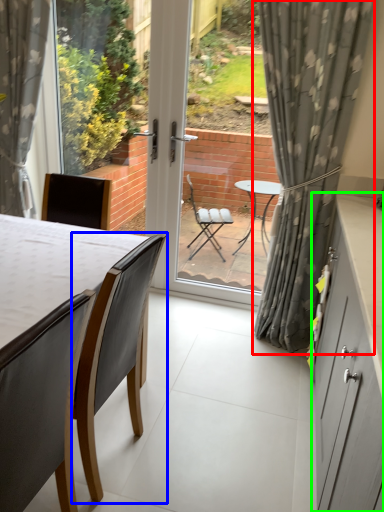
Question: Estimate the real-world distances between objects in this image. Which object is farther from curtain (highlighted by a red box), chair (highlighted by a blue box) or cabinetry (highlighted by a green box)?

Choices:
 (A) chair
 (B) cabinetry

Answer: (A)